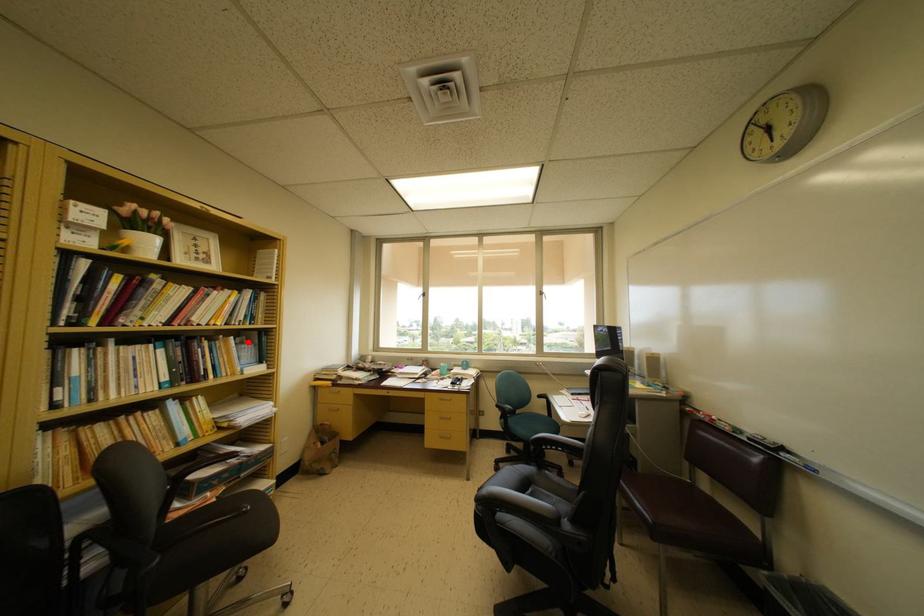
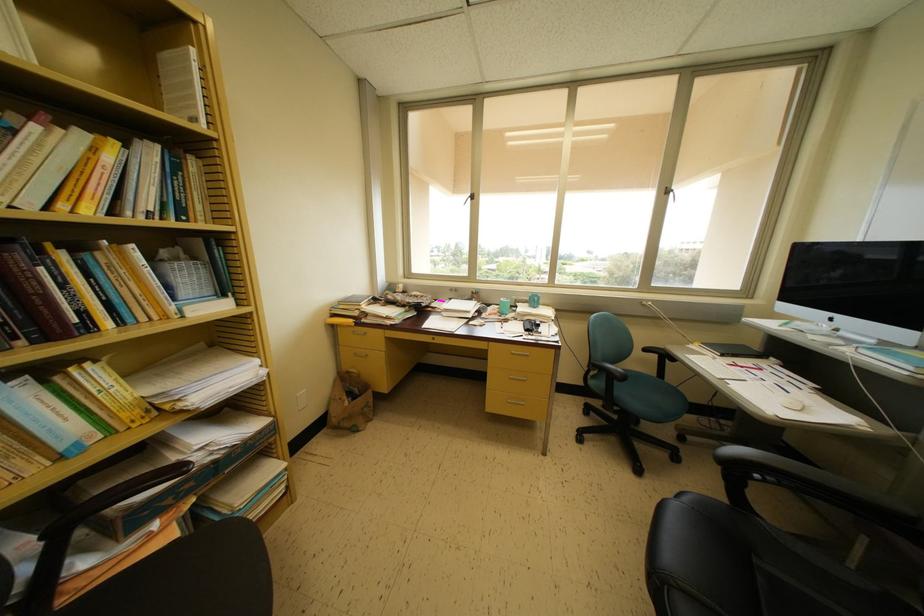
Locate, in the second image, the point that corresponds to the highlighted location in the first image.

(181, 253)